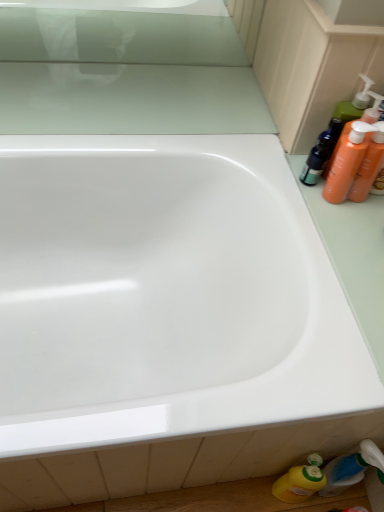
Question: From the image's perspective, is yellow plastic bottle at lower right, positioned as the 1th cleaning product in left-to-right order, above or below orange plastic bottles at right, which ranks as the second toiletry in bottom-to-top order?

Choices:
 (A) above
 (B) below

Answer: (B)

Question: Is yellow plastic bottle at lower right, acting as the second cleaning product starting from the top, inside the boundaries of orange plastic bottles at right, which ranks as the second toiletry in bottom-to-top order, or outside?

Choices:
 (A) outside
 (B) inside

Answer: (A)

Question: Considering the real-world distances, which object is closest to the yellow plastic bottle at lower right, acting as the second cleaning product starting from the right?

Choices:
 (A) orange plastic bottles at right, positioned as the second toiletry in top-to-bottom order
 (B) orange plastic bottles at upper right, the 1th toiletry from the top
 (C) translucent plastic bottle at lower right, which ranks as the 3th toiletry in top-to-bottom order
 (D) orange plastic bottles at upper right, the first cleaning product positioned from the top
 (E) white glossy bathtub at center

Answer: (C)

Question: Which is nearer to the orange plastic bottles at upper right, marked as the second cleaning product in a left-to-right arrangement?

Choices:
 (A) orange plastic bottles at right, which ranks as the second toiletry in bottom-to-top order
 (B) yellow plastic bottle at lower right, acting as the second cleaning product starting from the top
 (C) orange plastic bottles at upper right, the 1th toiletry from the top
 (D) translucent plastic bottle at lower right, which ranks as the 3th toiletry in top-to-bottom order
 (E) white glossy bathtub at center

Answer: (C)